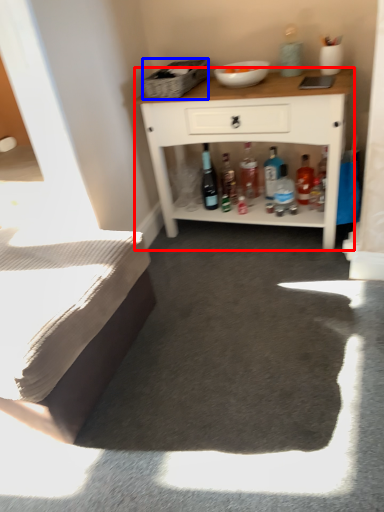
Question: Which object appears farthest to the camera in this image, cabinetry (highlighted by a red box) or picnic basket (highlighted by a blue box)?

Choices:
 (A) cabinetry
 (B) picnic basket

Answer: (B)